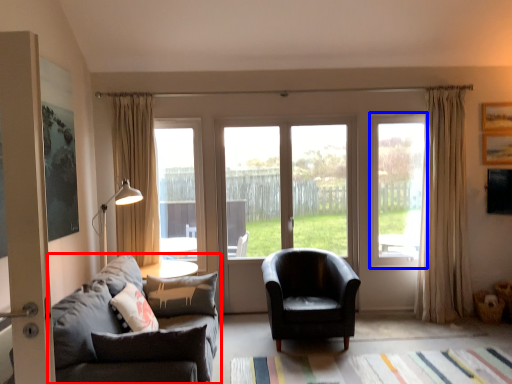
Question: Which of the following is the farthest to the observer, studio couch (highlighted by a red box) or window (highlighted by a blue box)?

Choices:
 (A) studio couch
 (B) window

Answer: (B)